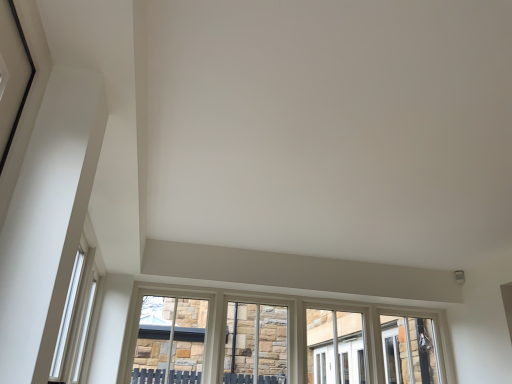
Question: Should I look upward or downward to see white textured window at center?

Choices:
 (A) up
 (B) down

Answer: (B)